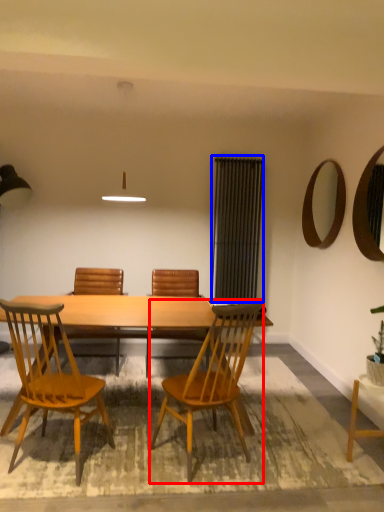
Question: Which point is closer to the camera, chair (highlighted by a red box) or screen door (highlighted by a blue box)?

Choices:
 (A) chair
 (B) screen door

Answer: (A)